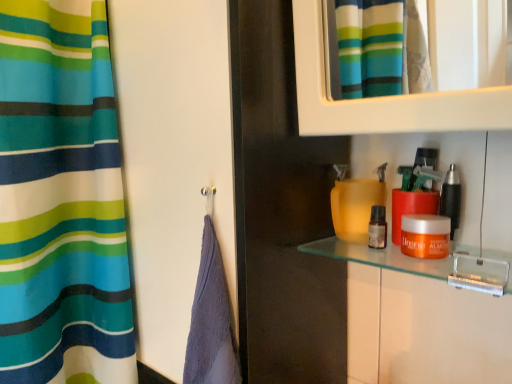
Question: Can you confirm if translucent glass shelf at center is thinner than orange matte jar at right, which ranks as the 2th cosmetic in left-to-right order?

Choices:
 (A) yes
 (B) no

Answer: (B)

Question: Is translucent glass shelf at center facing towards orange matte jar at right, which ranks as the 2th cosmetic in left-to-right order?

Choices:
 (A) yes
 (B) no

Answer: (B)

Question: From a real-world perspective, is translucent glass shelf at center on orange matte jar at right, which ranks as the 2th cosmetic in left-to-right order?

Choices:
 (A) no
 (B) yes

Answer: (A)

Question: From the image's perspective, is translucent glass shelf at center under orange matte jar at right, which appears as the second cosmetic when viewed from the right?

Choices:
 (A) no
 (B) yes

Answer: (B)

Question: Is translucent glass shelf at center to the left of orange matte jar at right, which ranks as the 2th cosmetic in left-to-right order, from the viewer's perspective?

Choices:
 (A) yes
 (B) no

Answer: (A)

Question: Is transparent glass screen door at center situated inside translucent amber bottle at center, the 3th cosmetic in the right-to-left sequence, or outside?

Choices:
 (A) outside
 (B) inside

Answer: (A)

Question: From the image's perspective, is transparent glass screen door at center positioned above or below translucent amber bottle at center, marked as the 1th cosmetic in a left-to-right arrangement?

Choices:
 (A) above
 (B) below

Answer: (A)

Question: Considering the positions of transparent glass screen door at center and translucent amber bottle at center, marked as the 1th cosmetic in a left-to-right arrangement, in the image, is transparent glass screen door at center wider or thinner than translucent amber bottle at center, marked as the 1th cosmetic in a left-to-right arrangement,?

Choices:
 (A) wide
 (B) thin

Answer: (A)

Question: Does point (124, 117) appear closer or farther from the camera than point (373, 230)?

Choices:
 (A) closer
 (B) farther

Answer: (B)

Question: Looking at the image, does translucent glass shelf at center seem bigger or smaller compared to transparent glass screen door at center?

Choices:
 (A) big
 (B) small

Answer: (B)

Question: From the image's perspective, is translucent glass shelf at center located above or below transparent glass screen door at center?

Choices:
 (A) below
 (B) above

Answer: (A)

Question: Is translucent glass shelf at center inside or outside of transparent glass screen door at center?

Choices:
 (A) outside
 (B) inside

Answer: (A)

Question: Visually, is translucent glass shelf at center positioned to the left or to the right of transparent glass screen door at center?

Choices:
 (A) left
 (B) right

Answer: (B)

Question: Considering the positions of metallic black razor at right, the first cosmetic viewed from the right, and transparent glass screen door at center in the image, is metallic black razor at right, the first cosmetic viewed from the right, bigger or smaller than transparent glass screen door at center?

Choices:
 (A) big
 (B) small

Answer: (B)

Question: From their relative heights in the image, would you say metallic black razor at right, the first cosmetic viewed from the right, is taller or shorter than transparent glass screen door at center?

Choices:
 (A) short
 (B) tall

Answer: (A)